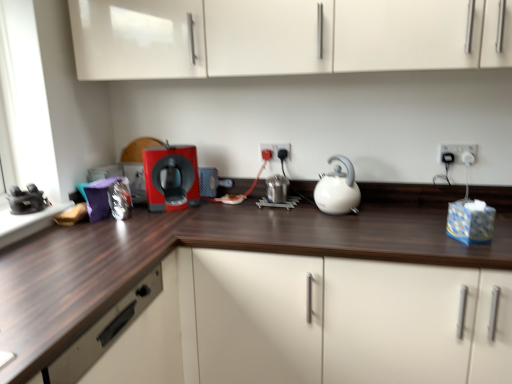
Question: Considering the positions of matte plastic plug at center, the second electric outlet in the right-to-left sequence, and white glossy kettle at center in the image, is matte plastic plug at center, the second electric outlet in the right-to-left sequence, bigger or smaller than white glossy kettle at center?

Choices:
 (A) small
 (B) big

Answer: (A)

Question: From the image's perspective, is matte plastic plug at center, the second electric outlet in the right-to-left sequence, located above or below white glossy kettle at center?

Choices:
 (A) below
 (B) above

Answer: (B)

Question: Estimate the real-world distances between objects in this image. Which object is closer to the matte plastic plug at center, the second electric outlet in the right-to-left sequence?

Choices:
 (A) dark wood countertop at center
 (B) white glossy kettle at center
 (C) matte plastic coffee machine at center
 (D) wooden drawer at lower left
 (E) white plastic electric outlet at upper right, positioned as the 2th electric outlet in back-to-front order

Answer: (B)

Question: Estimate the real-world distances between objects in this image. Which object is farther from the matte plastic coffee machine at center?

Choices:
 (A) dark wood countertop at center
 (B) matte plastic plug at center, arranged as the second electric outlet when viewed from the front
 (C) wooden drawer at lower left
 (D) white plastic electric outlet at upper right, placed as the first electric outlet when sorted from front to back
 (E) white glossy kettle at center

Answer: (D)